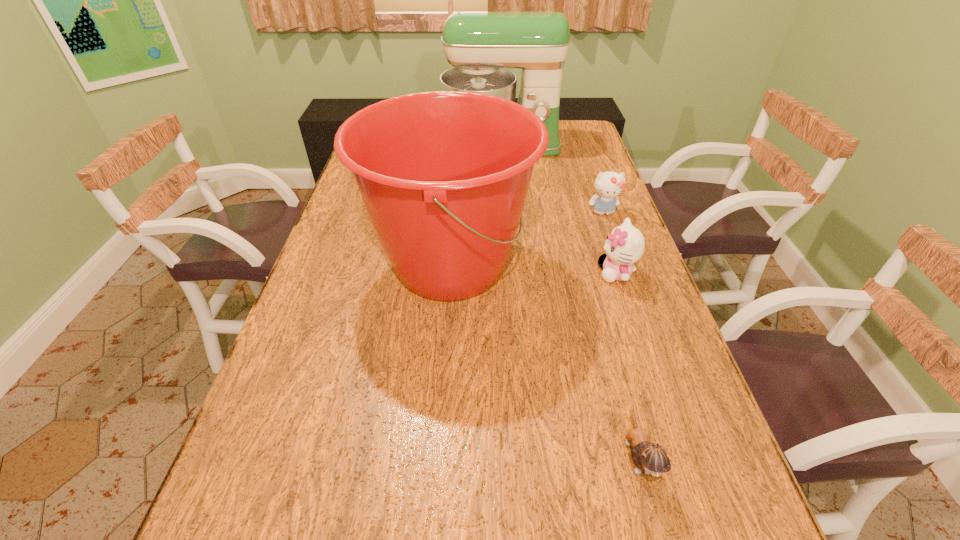
The image size is (960, 540). What are the coordinates of `the farthest object` in the screenshot? It's located at (480, 45).

In order to click on bucket in this screenshot , I will do [444, 175].

This screenshot has width=960, height=540. What are the coordinates of `the second farthest kitten` in the screenshot? It's located at (625, 245).

Identify the location of the farthest kitten. (609, 185).

The image size is (960, 540). Identify the location of the shortest object. (651, 458).

The image size is (960, 540). I want to click on the nearest kitten, so click(651, 458).

Where is `vacant space located on the controls of the mixer`? vacant space located on the controls of the mixer is located at coordinates (505, 187).

This screenshot has height=540, width=960. In order to click on vacant region located 0.190m with the handle attached to the rim of the second tallest object in this screenshot , I will do pos(606,266).

I want to click on free space located on the front-facing side of the second farthest kitten, so click(474, 273).

Find the location of a particular element. blank space located 0.270m on the front-facing side of the second farthest kitten is located at coordinates (493, 273).